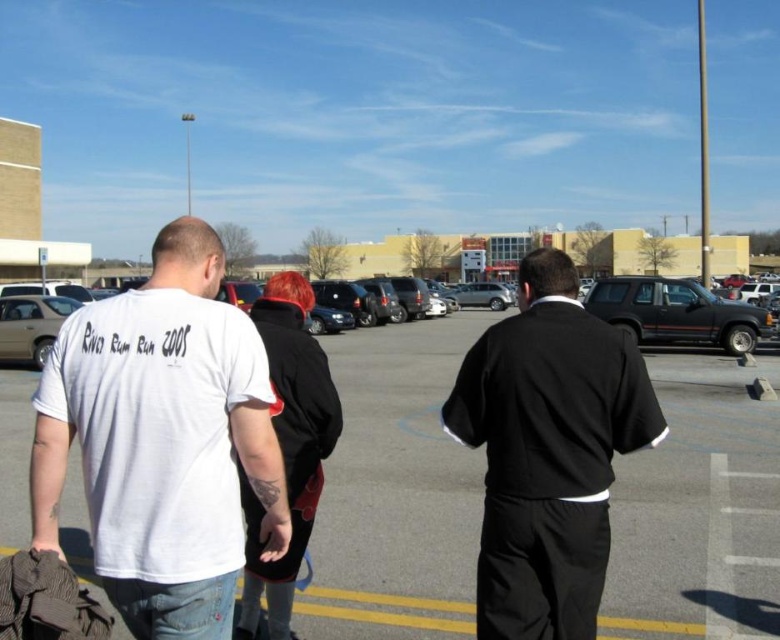
Does white cotton t-shirt at center lie in front of black smooth suit at center?

Yes, it is.

This screenshot has height=640, width=780. Describe the element at coordinates (162, 440) in the screenshot. I see `white cotton t-shirt at center` at that location.

Is point (59, 477) more distant than point (566, 548)?

No, it is in front of (566, 548).

Where is `white cotton t-shirt at center`? The image size is (780, 640). white cotton t-shirt at center is located at coordinates (162, 440).

Does point (575, 344) lie in front of point (624, 323)?

Yes, point (575, 344) is in front of point (624, 323).

This screenshot has height=640, width=780. I want to click on black smooth suit at center, so click(548, 451).

Between black smooth suit at center and matte silver sedan at left, which one is positioned lower?

black smooth suit at center

Is black smooth suit at center above matte silver sedan at left?

Incorrect, black smooth suit at center is not positioned above matte silver sedan at left.

The height and width of the screenshot is (640, 780). I want to click on black smooth suit at center, so click(x=548, y=451).

Find the location of a particular element. black smooth suit at center is located at coordinates (548, 451).